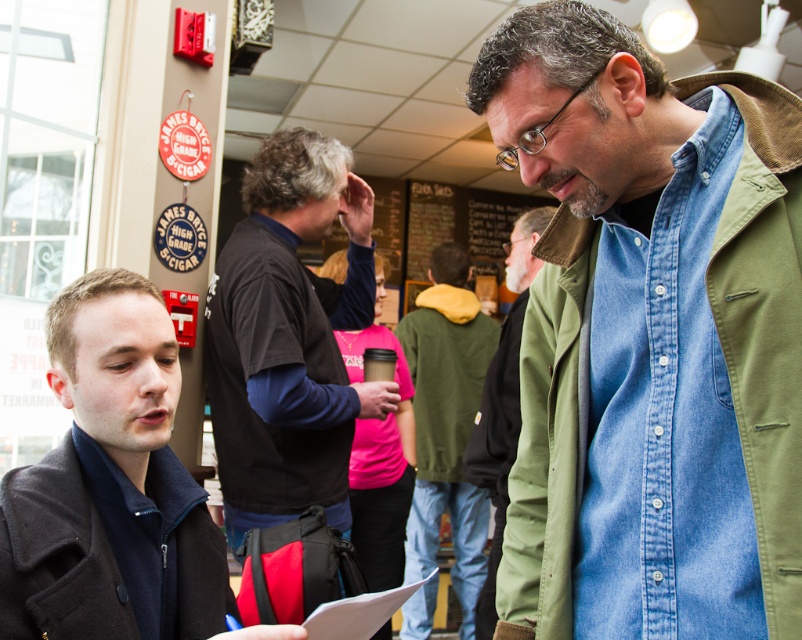
Between denim shirt at center and green matte jacket at center, which one has less height?

Standing shorter between the two is denim shirt at center.

The height and width of the screenshot is (640, 802). Describe the element at coordinates (651, 339) in the screenshot. I see `denim shirt at center` at that location.

Find the location of `denim shirt at center`. denim shirt at center is located at coordinates (651, 339).

Between black softshell jacket at center and dark green fleece jacket at center, which one has more height?

black softshell jacket at center is taller.

Consider the image. Between black softshell jacket at center and dark green fleece jacket at center, which one has less height?

With less height is dark green fleece jacket at center.

Who is more distant from viewer, (x=306, y=211) or (x=513, y=417)?

Point (x=306, y=211)

You are a GUI agent. You are given a task and a screenshot of the screen. Output one action in this format:
    pyautogui.click(x=<x>, y=<y>)
    Task: Click on the black softshell jacket at center
    
    Given the screenshot: What is the action you would take?
    pyautogui.click(x=290, y=339)

Does black wool coat at lower left have a larger size compared to green carhartt jacket at center?

Incorrect, black wool coat at lower left is not larger than green carhartt jacket at center.

Which is above, black wool coat at lower left or green carhartt jacket at center?

green carhartt jacket at center

Where is `black wool coat at lower left`? This screenshot has height=640, width=802. black wool coat at lower left is located at coordinates (95, 561).